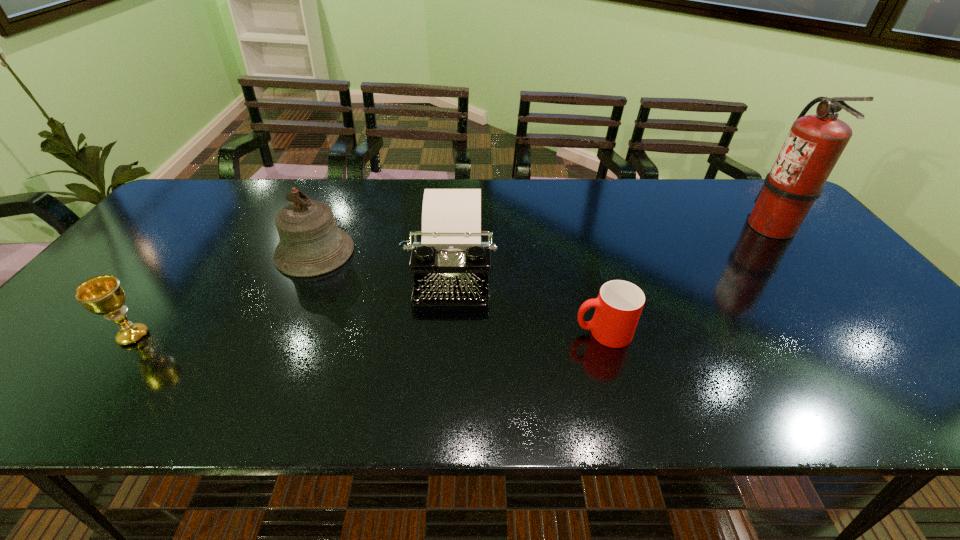
At what (x,y) coordinates should I click in order to perform the action: click on vacant space that is in between the fire extinguisher and the cup. Please return your answer as a coordinate pair (x, y). Looking at the image, I should click on 686,279.

Locate an element on the screen. empty space between the rightmost object and the third object from left to right is located at coordinates (611, 248).

Find the location of a particular element. The height and width of the screenshot is (540, 960). free point between the tallest object and the fourth shortest object is located at coordinates (542, 239).

At what (x,y) coordinates should I click in order to perform the action: click on object that is the fourth closest to the shortest object. Please return your answer as a coordinate pair (x, y). The width and height of the screenshot is (960, 540). Looking at the image, I should click on point(103,295).

Find the location of a particular element. This screenshot has height=540, width=960. object that is the fourth nearest to the tallest object is located at coordinates (103, 295).

The image size is (960, 540). What are the coordinates of `free space that satisfies the following two spatial constraints: 1. on the side of the second object from right to left with the handle; 2. on the keys of the typewriter` in the screenshot? It's located at (587, 271).

What are the coordinates of `free space that satisfies the following two spatial constraints: 1. on the keys of the third object from right to left; 2. on the side of the fourth object from left to right with the handle` in the screenshot? It's located at (445, 333).